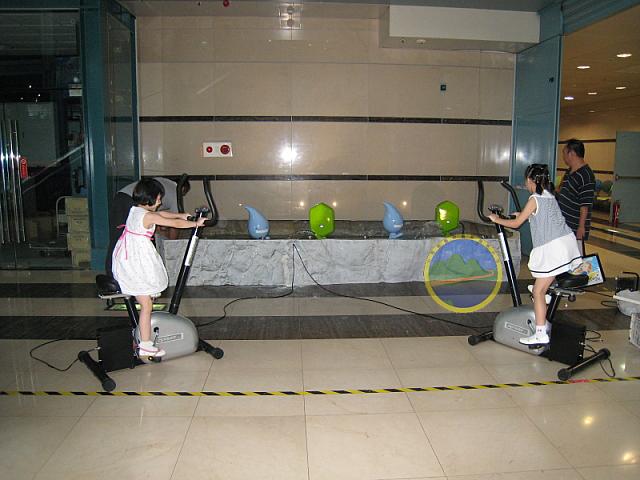
Identify the location of tile floor. (387, 438).